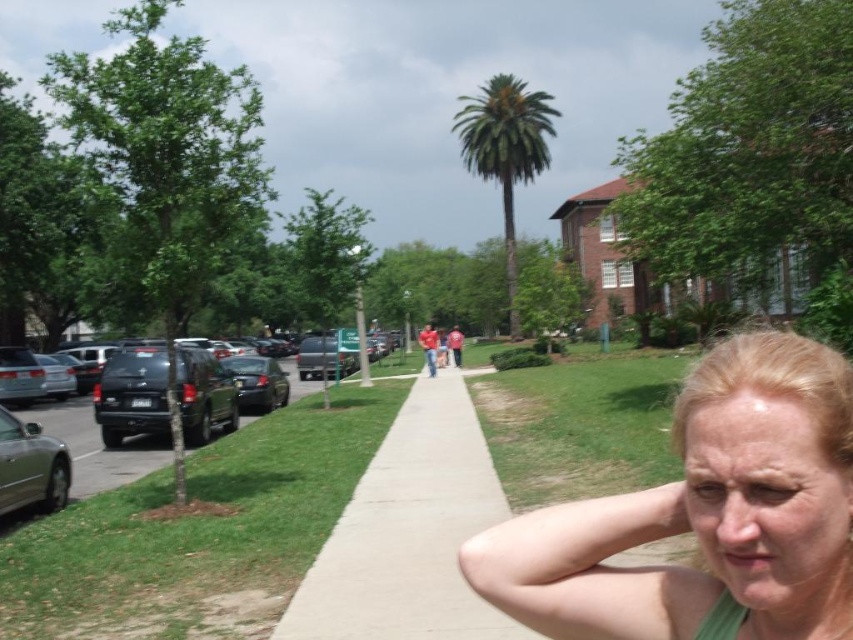
Is pale skin face at lower right below matte black suv at left?

No.

Does pale skin face at lower right appear on the right side of matte black suv at left?

Indeed, pale skin face at lower right is positioned on the right side of matte black suv at left.

Where is `pale skin face at lower right`? pale skin face at lower right is located at coordinates click(x=769, y=502).

Which is more to the right, green concrete sidewalk at center or matte black suv at left?

From the viewer's perspective, green concrete sidewalk at center appears more on the right side.

Is point (410, 609) in front of point (190, 364)?

Yes.

Locate an element on the screen. green concrete sidewalk at center is located at coordinates (409, 532).

What do you see at coordinates (705, 515) in the screenshot? I see `green matte tank top at center` at bounding box center [705, 515].

Which is above, green matte tank top at center or silver metallic car at left?

Positioned higher is green matte tank top at center.

Image resolution: width=853 pixels, height=640 pixels. In order to click on green matte tank top at center in this screenshot , I will do `click(705, 515)`.

Find the location of a particular element. This screenshot has height=640, width=853. green matte tank top at center is located at coordinates (705, 515).